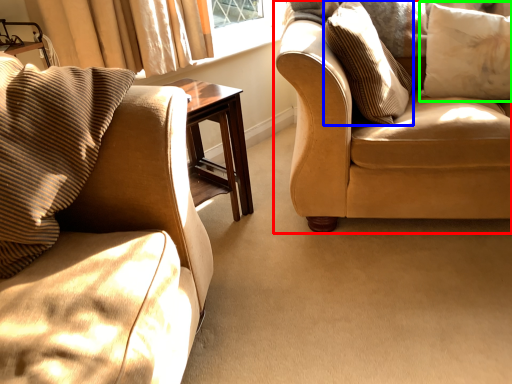
Question: Considering the real-world distances, which object is closest to studio couch (highlighted by a red box)? pillow (highlighted by a blue box) or pillow (highlighted by a green box).

Choices:
 (A) pillow
 (B) pillow

Answer: (A)